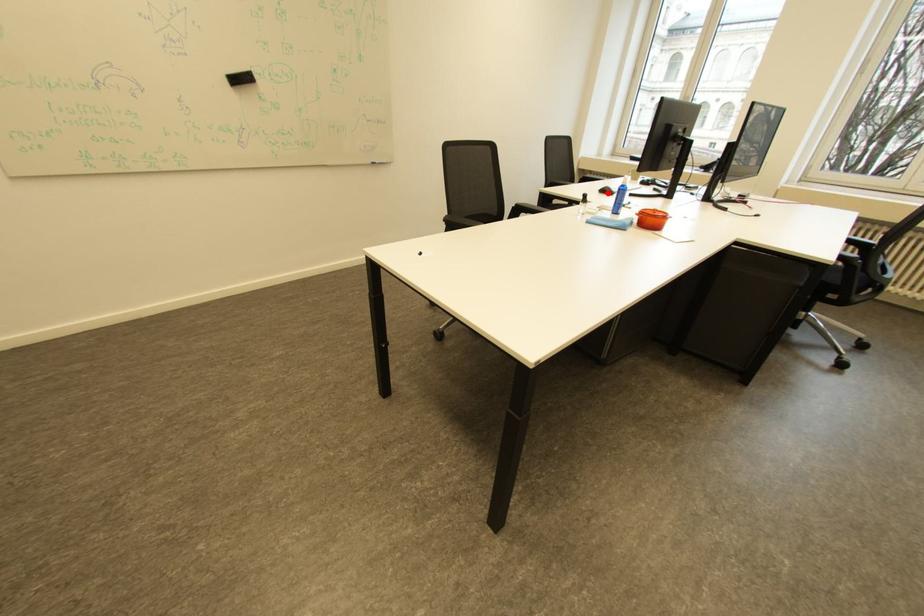
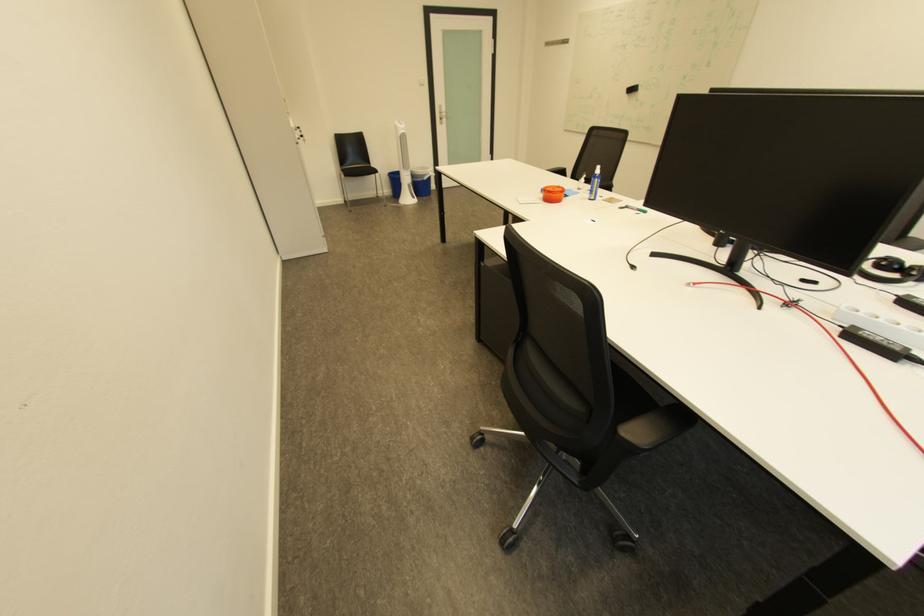
Question: I am providing you with two images of the same scene from different viewpoints. A red point is marked on the first image. Is the red point's position out of view in image 2?

Choices:
 (A) Yes
 (B) No

Answer: (A)